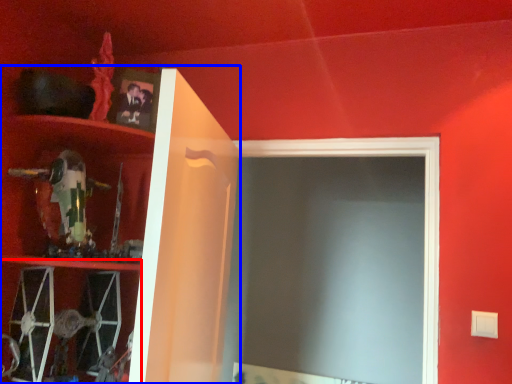
Question: Among these objects, which one is nearest to the camera, cabinet (highlighted by a red box) or cabinet (highlighted by a blue box)?

Choices:
 (A) cabinet
 (B) cabinet

Answer: (B)